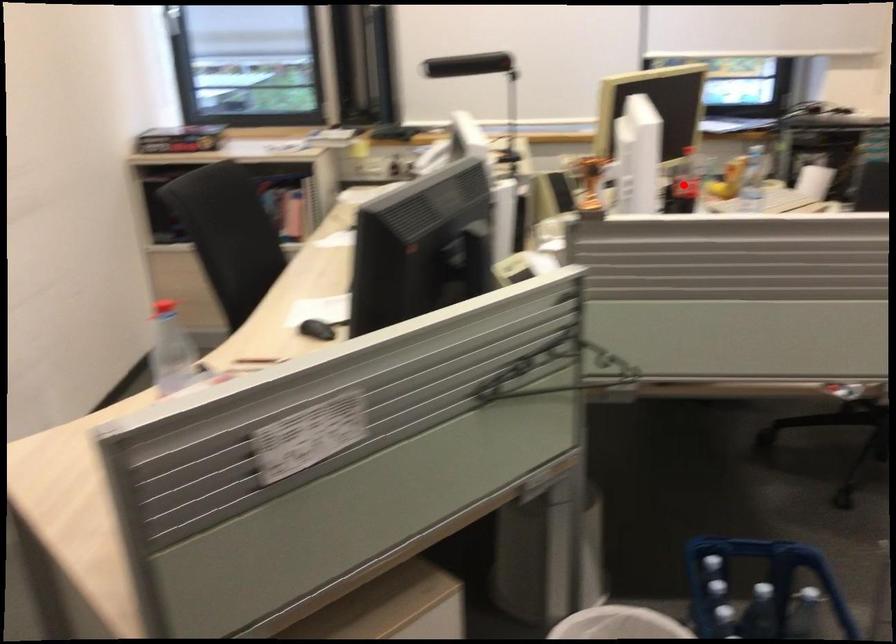
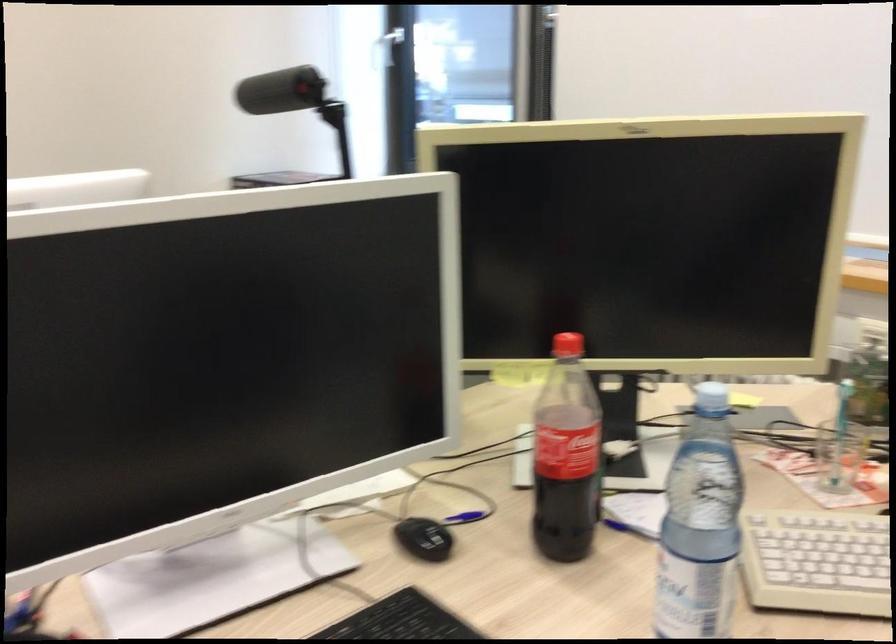
Question: I am providing you with two images of the same scene from different viewpoints. Given a red point in image1, look at the same physical point in image2. Is it:

Choices:
 (A) Closer to the viewpoint
 (B) Farther from the viewpoint

Answer: (A)